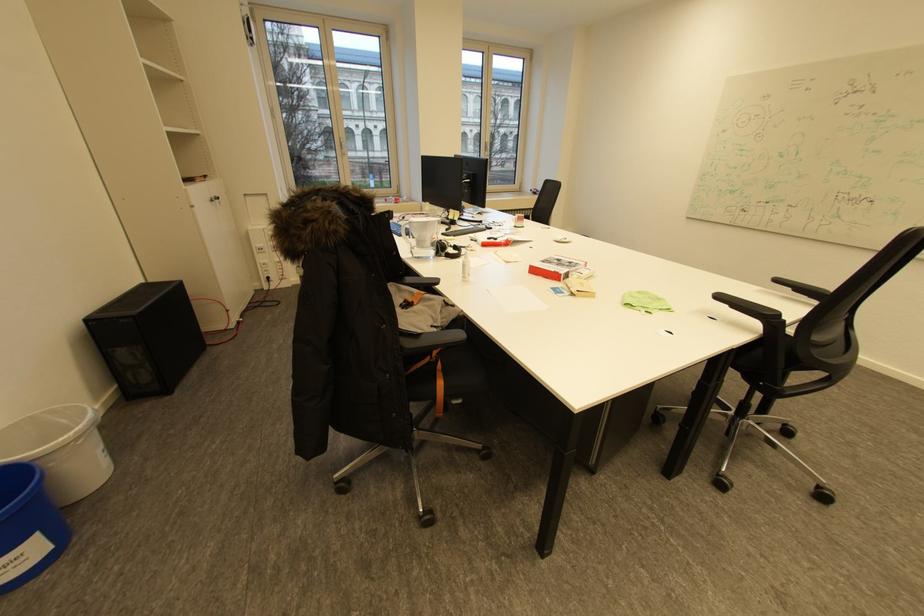
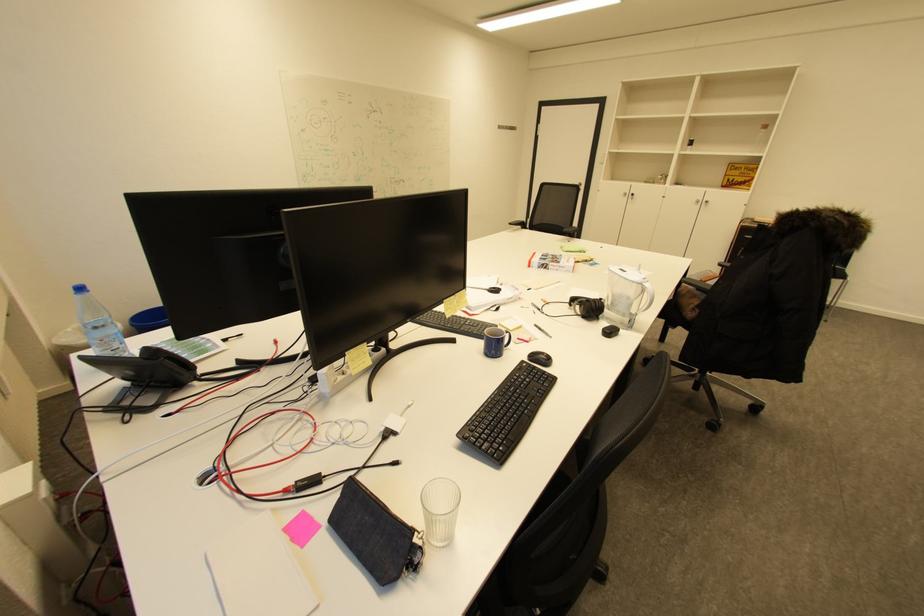
Find the pixel in the second image that matches point 784,282 in the first image.

(517, 225)